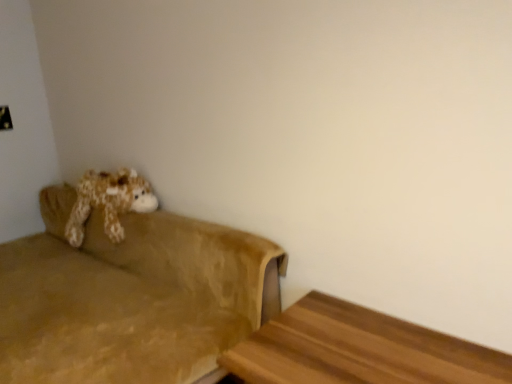
Question: Is suede-like brown couch at left bigger than fluffy brown plush at left?

Choices:
 (A) yes
 (B) no

Answer: (A)

Question: Is suede-like brown couch at left located outside fluffy brown plush at left?

Choices:
 (A) no
 (B) yes

Answer: (B)

Question: Considering the relative sizes of suede-like brown couch at left and fluffy brown plush at left in the image provided, is suede-like brown couch at left wider than fluffy brown plush at left?

Choices:
 (A) yes
 (B) no

Answer: (A)

Question: From a real-world perspective, is suede-like brown couch at left physically below fluffy brown plush at left?

Choices:
 (A) no
 (B) yes

Answer: (B)

Question: Is suede-like brown couch at left facing away from fluffy brown plush at left?

Choices:
 (A) yes
 (B) no

Answer: (A)

Question: Is suede-like brown couch at left positioned behind fluffy brown plush at left?

Choices:
 (A) no
 (B) yes

Answer: (A)

Question: Does wooden table at lower right appear on the right side of fluffy brown plush at left?

Choices:
 (A) yes
 (B) no

Answer: (A)

Question: Is wooden table at lower right not within fluffy brown plush at left?

Choices:
 (A) yes
 (B) no

Answer: (A)

Question: Is wooden table at lower right touching fluffy brown plush at left?

Choices:
 (A) no
 (B) yes

Answer: (A)

Question: Does wooden table at lower right come in front of fluffy brown plush at left?

Choices:
 (A) no
 (B) yes

Answer: (B)

Question: Does wooden table at lower right appear on the left side of fluffy brown plush at left?

Choices:
 (A) yes
 (B) no

Answer: (B)

Question: From the image's perspective, is wooden table at lower right on top of fluffy brown plush at left?

Choices:
 (A) yes
 (B) no

Answer: (B)

Question: Is fluffy brown plush at left thinner than suede-like brown couch at left?

Choices:
 (A) yes
 (B) no

Answer: (A)